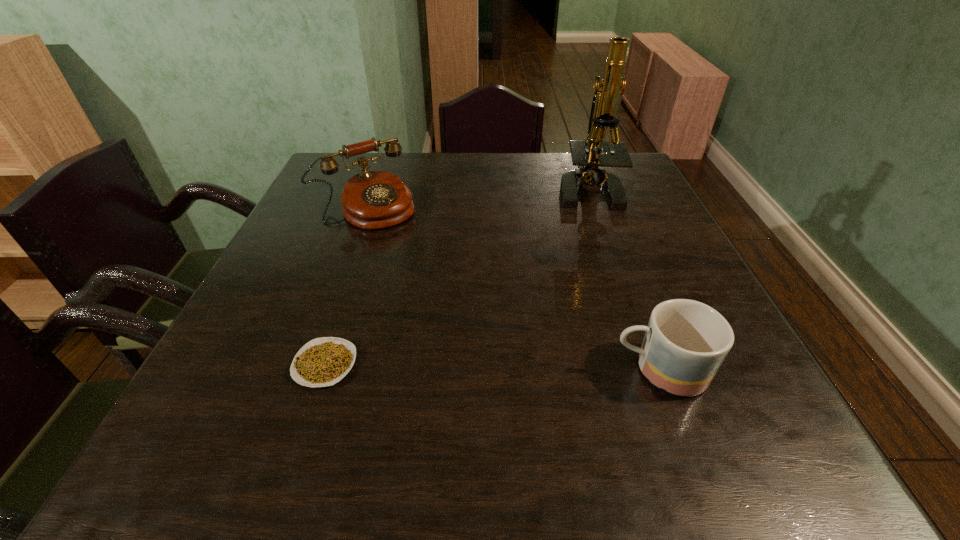
Locate an element on the screen. The width and height of the screenshot is (960, 540). free space located on the dial of the second tallest object is located at coordinates (468, 317).

Image resolution: width=960 pixels, height=540 pixels. In order to click on vacant space located at the eyepiece of the tallest object in this screenshot , I will do [541, 262].

Image resolution: width=960 pixels, height=540 pixels. I want to click on vacant space located at the eyepiece of the tallest object, so tap(565, 229).

Image resolution: width=960 pixels, height=540 pixels. In order to click on free space located at the eyepiece of the tallest object in this screenshot , I will do `click(564, 231)`.

Where is `telephone at the far edge`? This screenshot has width=960, height=540. telephone at the far edge is located at coordinates 371,200.

At what (x,y) coordinates should I click in order to perform the action: click on microscope located at the far edge. Please return your answer as a coordinate pair (x, y). The width and height of the screenshot is (960, 540). Looking at the image, I should click on (586, 154).

Image resolution: width=960 pixels, height=540 pixels. What are the coordinates of `legume at the near edge` in the screenshot? It's located at (324, 361).

The width and height of the screenshot is (960, 540). What are the coordinates of `mug that is at the near edge` in the screenshot? It's located at (686, 341).

This screenshot has width=960, height=540. In order to click on legume present at the left edge in this screenshot , I will do coord(324,361).

Identify the location of telephone that is at the left edge. Image resolution: width=960 pixels, height=540 pixels. click(371, 200).